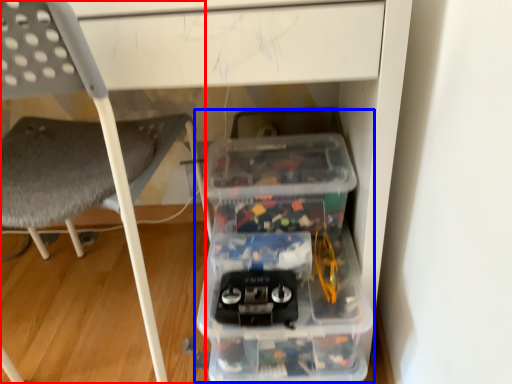
Question: Which object is further to the camera taking this photo, chair (highlighted by a red box) or storage box (highlighted by a blue box)?

Choices:
 (A) chair
 (B) storage box

Answer: (B)